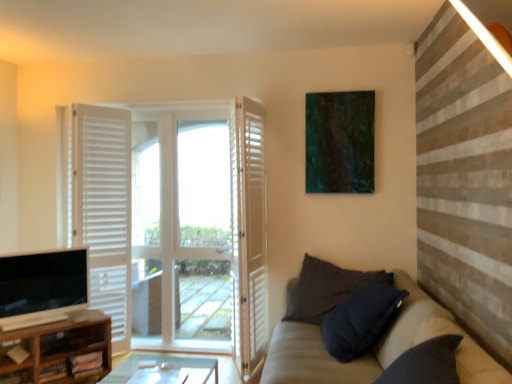
I want to click on brown wood cabinet at lower left, so click(60, 348).

Image resolution: width=512 pixels, height=384 pixels. Describe the element at coordinates (247, 234) in the screenshot. I see `white wooden door at center, the first door from the right` at that location.

What do you see at coordinates (104, 209) in the screenshot? This screenshot has height=384, width=512. I see `white wooden door at left, acting as the 3th door starting from the right` at bounding box center [104, 209].

This screenshot has height=384, width=512. What do you see at coordinates (191, 222) in the screenshot?
I see `white wooden door at center, the 2th door when ordered from right to left` at bounding box center [191, 222].

What do you see at coordinates (340, 142) in the screenshot? Image resolution: width=512 pixels, height=384 pixels. I see `teal matte painting at upper center` at bounding box center [340, 142].

Locate an element on the screen. The height and width of the screenshot is (384, 512). brown wood cabinet at lower left is located at coordinates (60, 348).

Between matte black tv at lower left and teal matte painting at upper center, which one has larger width?

Result: Wider between the two is matte black tv at lower left.

Is point (12, 299) farther from viewer compared to point (360, 189)?

No, it is in front of (360, 189).

Locate an element on the screen. This screenshot has height=384, width=512. television located underneath the teal matte painting at upper center (from a real-world perspective) is located at coordinates (x=42, y=287).

From a real-world perspective, between matte black tv at lower left and teal matte painting at upper center, who is vertically higher?

In real-world perspective, teal matte painting at upper center is above.

In terms of width, does beige fabric couch at lower right look wider or thinner when compared to matte black tv at lower left?

Clearly, beige fabric couch at lower right has more width compared to matte black tv at lower left.

Which of these two, beige fabric couch at lower right or matte black tv at lower left, is bigger?

Bigger between the two is beige fabric couch at lower right.

Which object is more forward, beige fabric couch at lower right or matte black tv at lower left?

beige fabric couch at lower right is closer to the camera.

Looking at this image, which is more to the right, brown wood cabinet at lower left or teal matte painting at upper center?

teal matte painting at upper center.

Relative to teal matte painting at upper center, is brown wood cabinet at lower left in front or behind?

brown wood cabinet at lower left is in front of teal matte painting at upper center.

Is brown wood cabinet at lower left facing away from teal matte painting at upper center?

That's not correct — brown wood cabinet at lower left is not looking away from teal matte painting at upper center.

Can you see brown wood cabinet at lower left touching teal matte painting at upper center?

brown wood cabinet at lower left is not next to teal matte painting at upper center, and they're not touching.

This screenshot has width=512, height=384. I want to click on picture frame that is on the right side of white wooden door at center, which is counted as the 2th door, starting from the left, so click(340, 142).

Considering the positions of objects white wooden door at center, which is counted as the 2th door, starting from the left, and teal matte painting at upper center in the image provided, who is more to the left, white wooden door at center, which is counted as the 2th door, starting from the left, or teal matte painting at upper center?

white wooden door at center, which is counted as the 2th door, starting from the left, is more to the left.

In the scene shown: How many degrees apart are the facing directions of white wooden door at center, the 2th door when ordered from right to left, and teal matte painting at upper center?

The angular difference between white wooden door at center, the 2th door when ordered from right to left, and teal matte painting at upper center is 0.661 degrees.

From the image's perspective, between white wooden door at center, which is counted as the 2th door, starting from the left, and teal matte painting at upper center, who is located below?

white wooden door at center, which is counted as the 2th door, starting from the left, from the image's perspective.

Considering the positions of objects teal matte painting at upper center and white wooden door at center, the 3th door when ordered from left to right, in the image provided, who is more to the right, teal matte painting at upper center or white wooden door at center, the 3th door when ordered from left to right,?

teal matte painting at upper center is more to the right.

In the scene shown: Could you tell me if teal matte painting at upper center is facing white wooden door at center, the 3th door when ordered from left to right?

No, teal matte painting at upper center does not turn towards white wooden door at center, the 3th door when ordered from left to right.

Can you confirm if teal matte painting at upper center is smaller than white wooden door at center, the 3th door when ordered from left to right?

Yes.

Is brown wood cabinet at lower left facing away from white wooden door at center, the first door from the right?

That's not correct — brown wood cabinet at lower left is not looking away from white wooden door at center, the first door from the right.

Does point (71, 323) appear closer or farther from the camera than point (239, 230)?

Point (71, 323) is closer to the camera than point (239, 230).

Visually, is brown wood cabinet at lower left positioned to the left or to the right of white wooden door at center, the first door from the right?

In the image, brown wood cabinet at lower left appears on the left side of white wooden door at center, the first door from the right.

Consider the image. Are brown wood cabinet at lower left and white wooden door at center, the first door from the right, making contact?

No.

Does white wooden door at center, which is counted as the 2th door, starting from the left, have a smaller size compared to matte black tv at lower left?

No, white wooden door at center, which is counted as the 2th door, starting from the left, is not smaller than matte black tv at lower left.

Between white wooden door at center, the 2th door when ordered from right to left, and matte black tv at lower left, which one appears on the right side from the viewer's perspective?

white wooden door at center, the 2th door when ordered from right to left, is more to the right.

In the image, is white wooden door at center, which is counted as the 2th door, starting from the left, positioned in front of or behind matte black tv at lower left?

Visually, white wooden door at center, which is counted as the 2th door, starting from the left, is located behind matte black tv at lower left.

From a real-world perspective, is white wooden door at center, which is counted as the 2th door, starting from the left, below matte black tv at lower left?

Incorrect, from a real-world perspective, white wooden door at center, which is counted as the 2th door, starting from the left, is higher than matte black tv at lower left.

Identify the location of television below the teal matte painting at upper center (from a real-world perspective). This screenshot has height=384, width=512. coord(42,287).

At what (x,y) coordinates should I click in order to perform the action: click on television that appears below the beige fabric couch at lower right (from the image's perspective). Please return your answer as a coordinate pair (x, y). This screenshot has height=384, width=512. Looking at the image, I should click on (42, 287).

Considering their positions, is dark textured pillow at lower right positioned further to matte black tv at lower left than brown wood cabinet at lower left?

dark textured pillow at lower right.

From the image, which object appears to be farther from beige fabric couch at lower right, white wooden door at center, which is counted as the 2th door, starting from the left, or teal matte painting at upper center?

white wooden door at center, which is counted as the 2th door, starting from the left, is positioned further to the anchor beige fabric couch at lower right.

Based on their spatial positions, is beige fabric couch at lower right or white wooden door at center, the first door from the right, closer to white wooden door at center, which is counted as the 2th door, starting from the left?

white wooden door at center, the first door from the right.

When comparing their distances from white wooden door at center, which is counted as the 2th door, starting from the left, does teal matte painting at upper center or dark textured pillow at lower right seem further?

teal matte painting at upper center is positioned further to the anchor white wooden door at center, which is counted as the 2th door, starting from the left.

From the image, which object appears to be farther from white wooden door at center, the 3th door when ordered from left to right, white wooden door at left, the first door when ordered from left to right, or matte black tv at lower left?

The object further to white wooden door at center, the 3th door when ordered from left to right, is matte black tv at lower left.

Based on their spatial positions, is dark textured pillow at lower right or matte black tv at lower left further from teal matte painting at upper center?

matte black tv at lower left is positioned further to the anchor teal matte painting at upper center.

Considering their positions, is white wooden door at center, the 2th door when ordered from right to left, positioned closer to dark textured pillow at lower right than teal matte painting at upper center?

Based on the image, teal matte painting at upper center appears to be nearer to dark textured pillow at lower right.

Considering their positions, is white wooden door at center, which is counted as the 2th door, starting from the left, positioned further to teal matte painting at upper center than white wooden door at left, acting as the 3th door starting from the right?

white wooden door at left, acting as the 3th door starting from the right, lies further to teal matte painting at upper center than the other object.

Where is `studio couch located between matte black tv at lower left and dark textured pillow at lower right in the left-right direction`? studio couch located between matte black tv at lower left and dark textured pillow at lower right in the left-right direction is located at coordinates (375, 347).

Locate an element on the screen. This screenshot has width=512, height=384. door between beige fabric couch at lower right and teal matte painting at upper center in the front-back direction is located at coordinates (247, 234).

The height and width of the screenshot is (384, 512). I want to click on pillow between matte black tv at lower left and teal matte painting at upper center in the horizontal direction, so click(326, 289).

Image resolution: width=512 pixels, height=384 pixels. In order to click on pillow between white wooden door at center, the 2th door when ordered from right to left, and teal matte painting at upper center from left to right in this screenshot , I will do `click(326, 289)`.